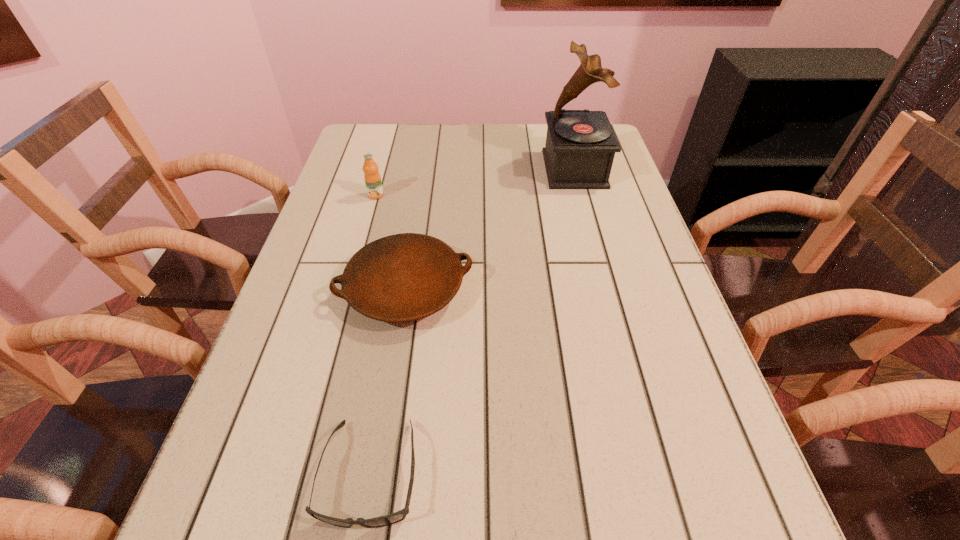
Find the location of a particular element. This screenshot has width=960, height=540. free space that satisfies the following two spatial constraints: 1. at the horn opening of the farthest object; 2. on the front-facing side of the sunglasses is located at coordinates (657, 473).

Find the location of a particular element. blank space that satisfies the following two spatial constraints: 1. on the label of the second farthest object; 2. on the left side of the plate is located at coordinates (349, 289).

Locate an element on the screen. This screenshot has height=540, width=960. free location that satisfies the following two spatial constraints: 1. on the label of the second nearest object; 2. on the left side of the orange juice is located at coordinates (349, 289).

I want to click on free region that satisfies the following two spatial constraints: 1. at the horn opening of the tallest object; 2. on the label of the orange juice, so click(582, 195).